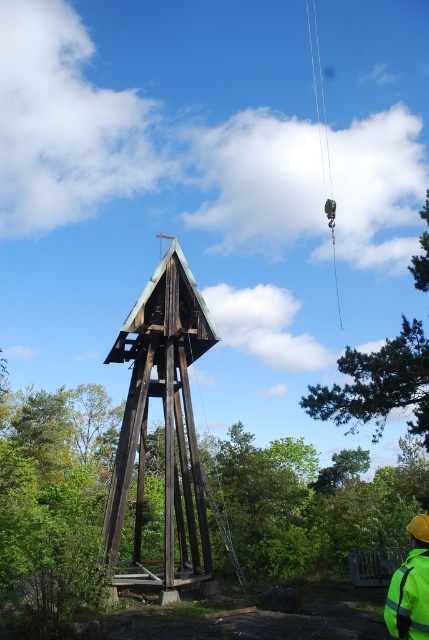
Can you confirm if brown wooden tower at center is positioned below black metal chain at upper center?

Yes, brown wooden tower at center is below black metal chain at upper center.

Is the position of brown wooden tower at center more distant than that of black metal chain at upper center?

No, brown wooden tower at center is in front of black metal chain at upper center.

Identify the location of brown wooden tower at center. (163, 413).

Identify the location of reflective yellow safety vest at lower right. (410, 588).

Can you confirm if reflective yellow safety vest at lower right is bigger than black metal chain at upper center?

No, reflective yellow safety vest at lower right is not bigger than black metal chain at upper center.

I want to click on reflective yellow safety vest at lower right, so click(x=410, y=588).

The image size is (429, 640). I want to click on reflective yellow safety vest at lower right, so click(410, 588).

Between green leafy tree at upper right and black metal chain at upper center, which one appears on the right side from the viewer's perspective?

green leafy tree at upper right is more to the right.

Is point (419, 353) positioned before point (308, 26)?

Yes, point (419, 353) is closer to viewer.

Locate an element on the screen. green leafy tree at upper right is located at coordinates (378, 385).